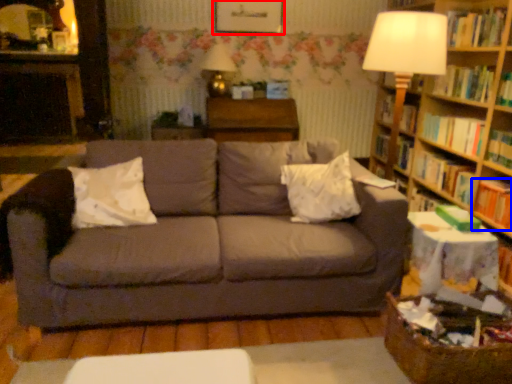
Question: Which object is closer to the camera taking this photo, picture frame (highlighted by a red box) or book (highlighted by a blue box)?

Choices:
 (A) picture frame
 (B) book

Answer: (B)